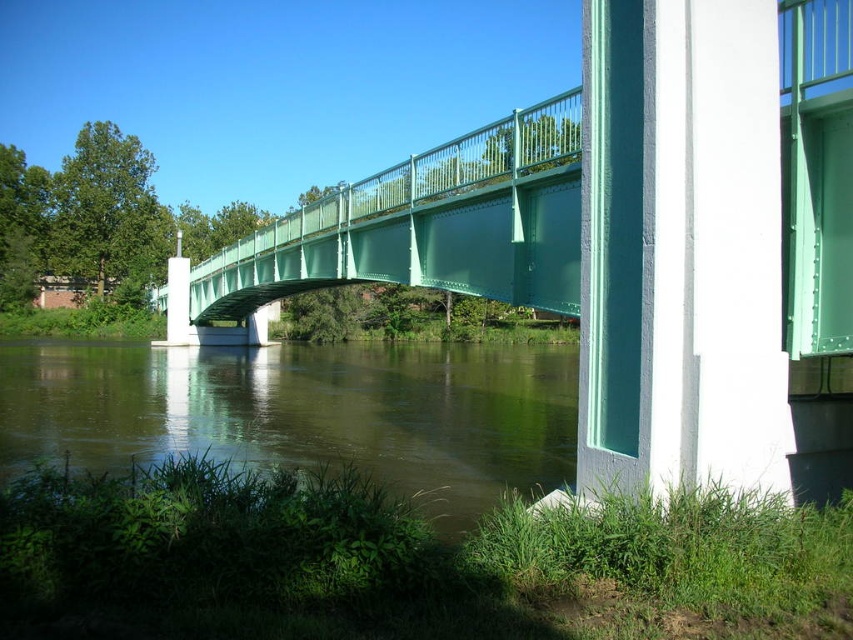
Between green painted concrete pillar at center-right and green painted steel bridge at center, which one appears on the left side from the viewer's perspective?

green painted steel bridge at center is more to the left.

Is point (634, 74) farther from viewer compared to point (393, 176)?

No.

The height and width of the screenshot is (640, 853). What are the coordinates of `green painted concrete pillar at center-right` in the screenshot? It's located at (680, 248).

Can you confirm if green painted concrete pillar at center-right is shorter than brown/muddy water at lower center?

No.

Is the position of green painted concrete pillar at center-right less distant than that of brown/muddy water at lower center?

Yes, green painted concrete pillar at center-right is in front of brown/muddy water at lower center.

The width and height of the screenshot is (853, 640). What are the coordinates of `green painted concrete pillar at center-right` in the screenshot? It's located at (680, 248).

Is brown/muddy water at lower center above green painted steel bridge at center?

No.

Does brown/muddy water at lower center appear on the right side of green painted steel bridge at center?

Indeed, brown/muddy water at lower center is positioned on the right side of green painted steel bridge at center.

Who is more distant from viewer, (x=85, y=412) or (x=257, y=276)?

The point (x=257, y=276) is behind.

This screenshot has height=640, width=853. I want to click on brown/muddy water at lower center, so click(x=303, y=412).